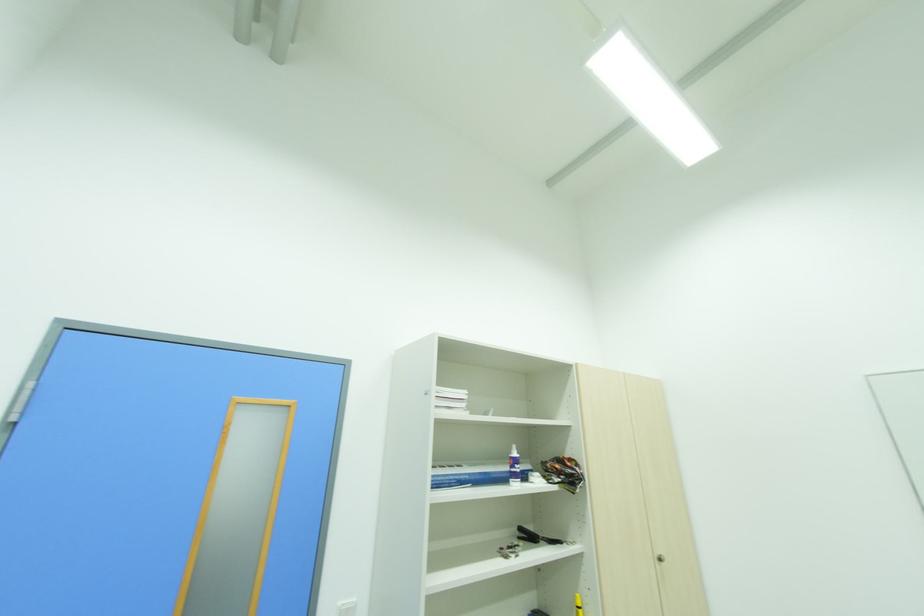
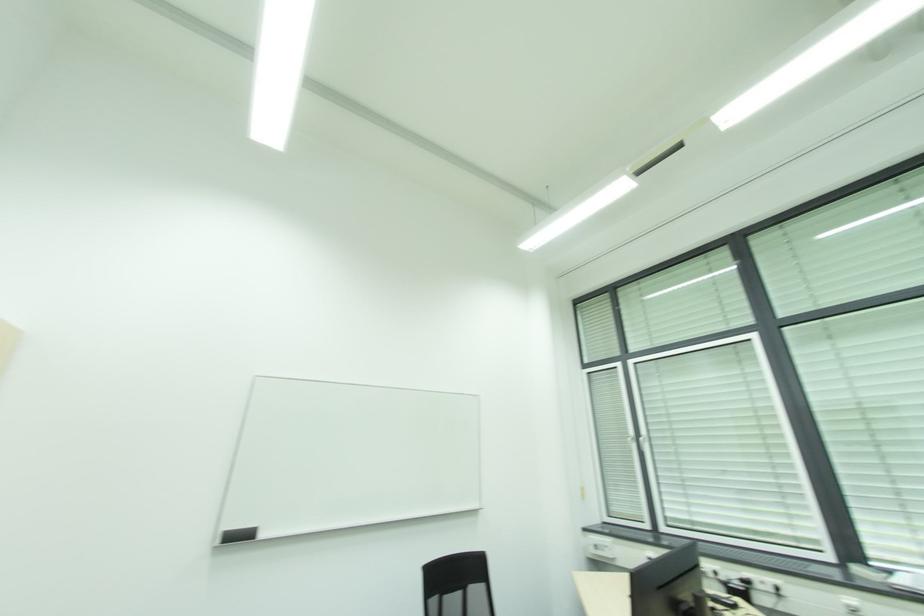
First-person continuous shooting, in which direction is the camera rotating?

The camera's rotation is toward right-up.